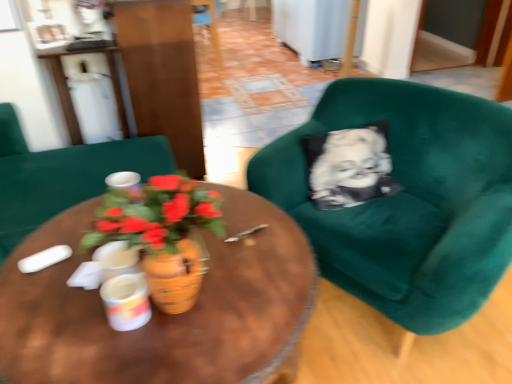
Identify the location of vacant space situated on the left part of white glossy coffee cup at center, placed as the 1th coffee cup when sorted from right to left. (65, 329).